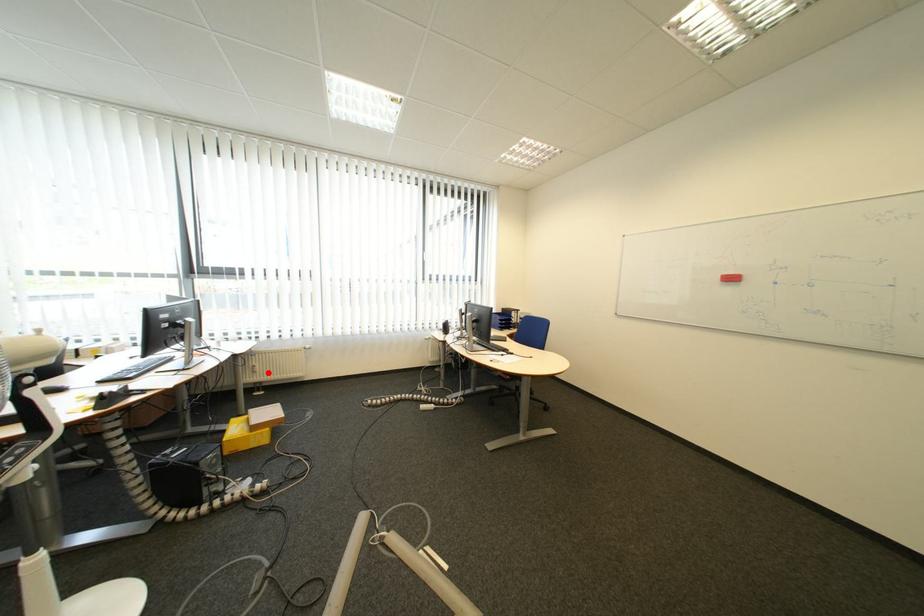
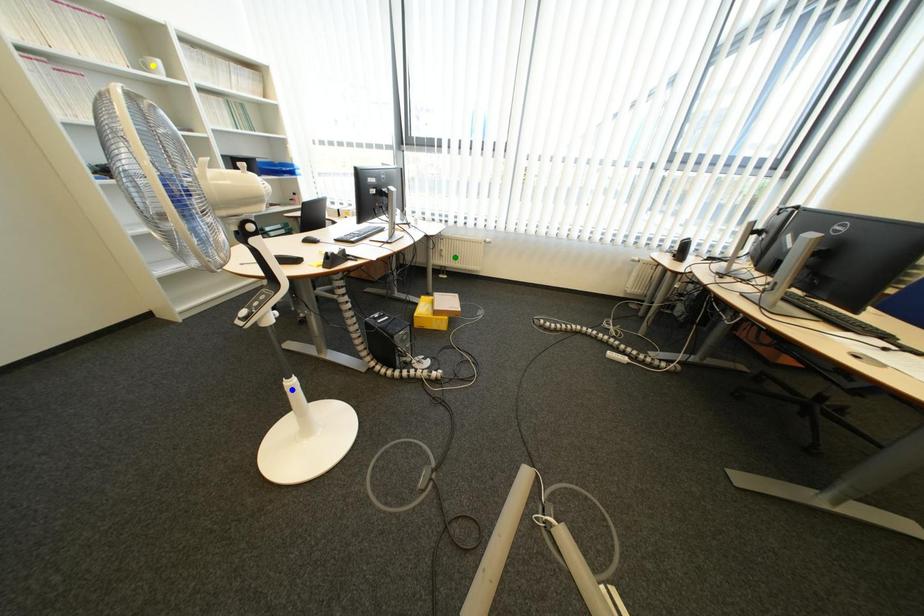
Question: I am providing you with two images of the same scene from different viewpoints. A red point is marked on the first image. You are given multiple points on the second image. Which mark in image 2 goes with the point in image 1?

Choices:
 (A) blue point
 (B) yellow point
 (C) green point

Answer: (C)